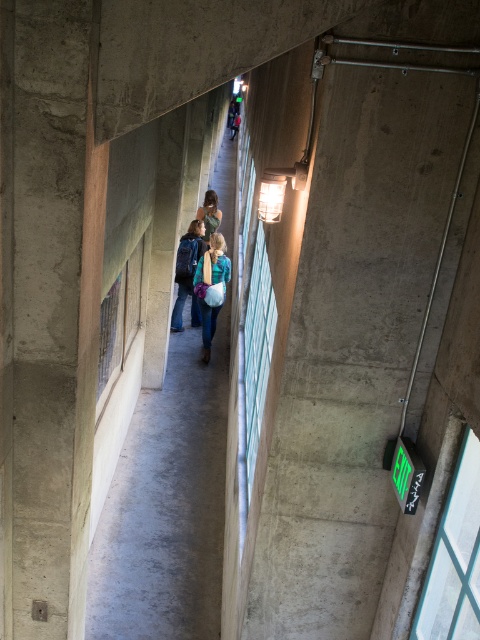
In the scene shown: Does denim jacket at center have a lesser height compared to matte blue backpack at center?

In fact, denim jacket at center may be taller than matte blue backpack at center.

Which of these two, denim jacket at center or matte blue backpack at center, stands shorter?

matte blue backpack at center

This screenshot has height=640, width=480. What do you see at coordinates (212, 288) in the screenshot?
I see `denim jacket at center` at bounding box center [212, 288].

Where is `denim jacket at center`? The image size is (480, 640). denim jacket at center is located at coordinates (212, 288).

Is point (100, 538) farther from camera compared to point (206, 212)?

That is False.

Can you confirm if concrete wall at center is positioned above matte black jacket at center?

Indeed, concrete wall at center is positioned over matte black jacket at center.

Identify the location of concrete wall at center. (158, 481).

Where is `concrete wall at center`? Image resolution: width=480 pixels, height=640 pixels. concrete wall at center is located at coordinates (158, 481).

Which is below, concrete wall at center or denim jacket at center?

denim jacket at center

Does concrete wall at center have a lesser width compared to denim jacket at center?

No.

Does point (128, 368) come behind point (212, 333)?

That is False.

You are a GUI agent. You are given a task and a screenshot of the screen. Output one action in this format:
    pyautogui.click(x=<x>, y=<y>)
    Task: Click on the concrete wall at center
    This screenshot has height=640, width=480.
    Given the screenshot: What is the action you would take?
    pyautogui.click(x=158, y=481)